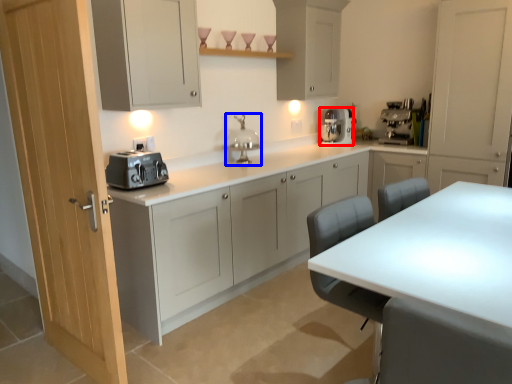
Question: Among these objects, which one is nearest to the camera, kitchen appliance (highlighted by a red box) or faucet (highlighted by a blue box)?

Choices:
 (A) kitchen appliance
 (B) faucet

Answer: (B)